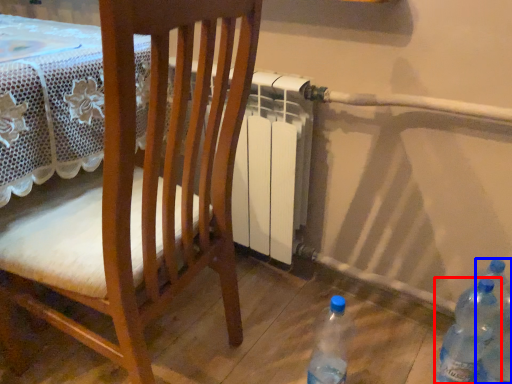
Question: Which of the following is the closest to the observer, bottle (highlighted by a red box) or bottle (highlighted by a blue box)?

Choices:
 (A) bottle
 (B) bottle

Answer: (B)